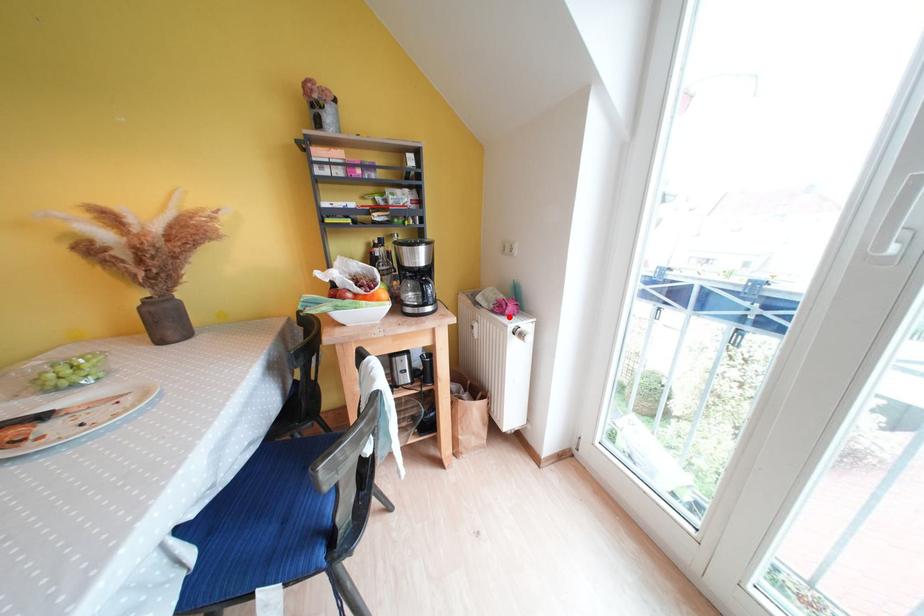
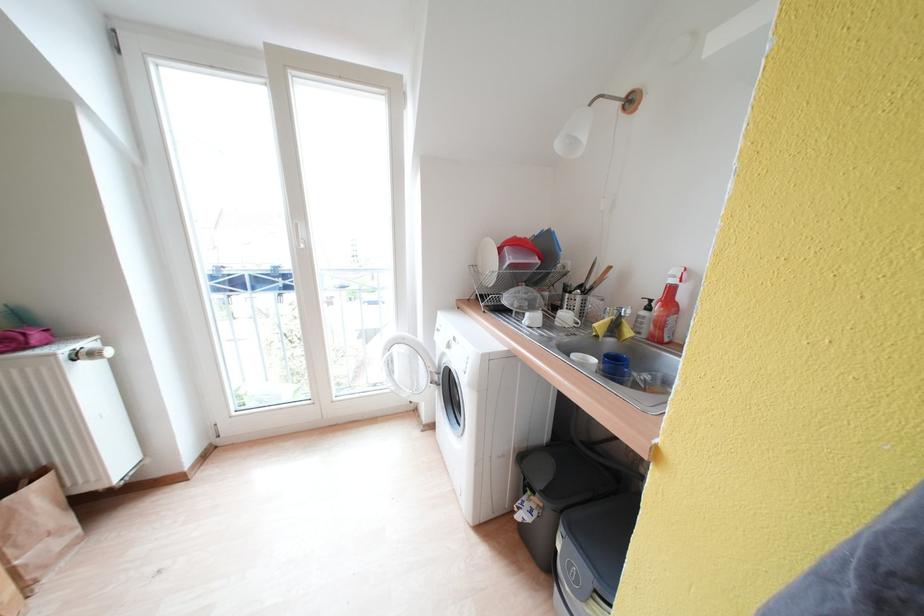
Where in the second image is the point corresponding to the highlighted location from the first image?

(30, 351)